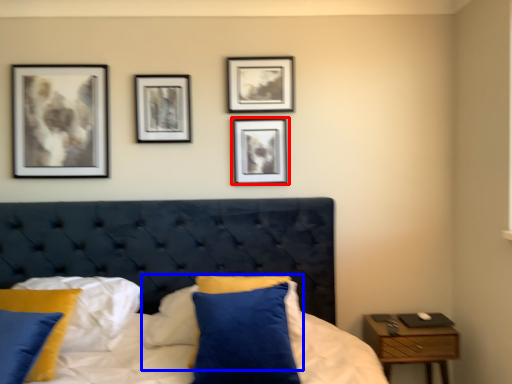
Question: Which of the following is the farthest to the observer, picture frame (highlighted by a red box) or pillow (highlighted by a blue box)?

Choices:
 (A) picture frame
 (B) pillow

Answer: (A)